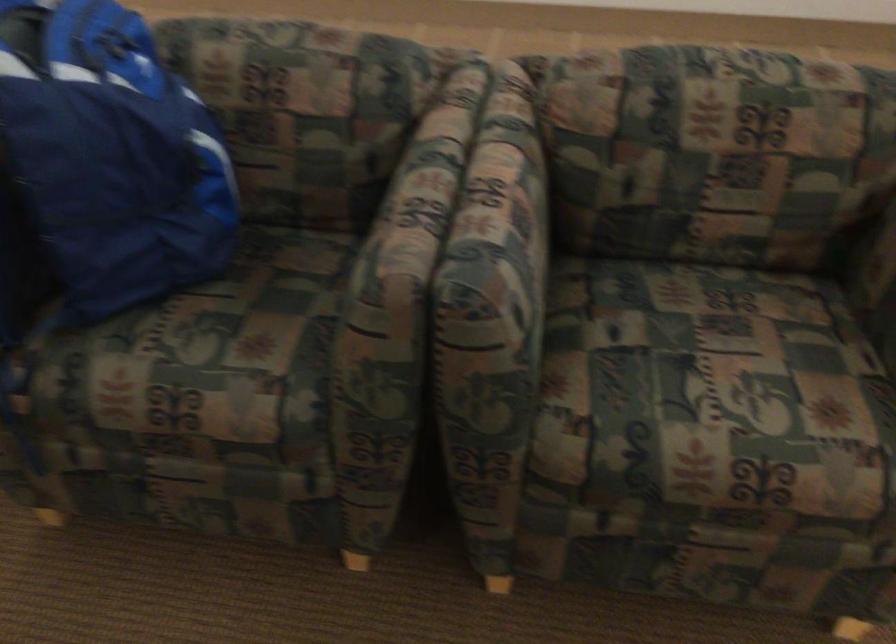
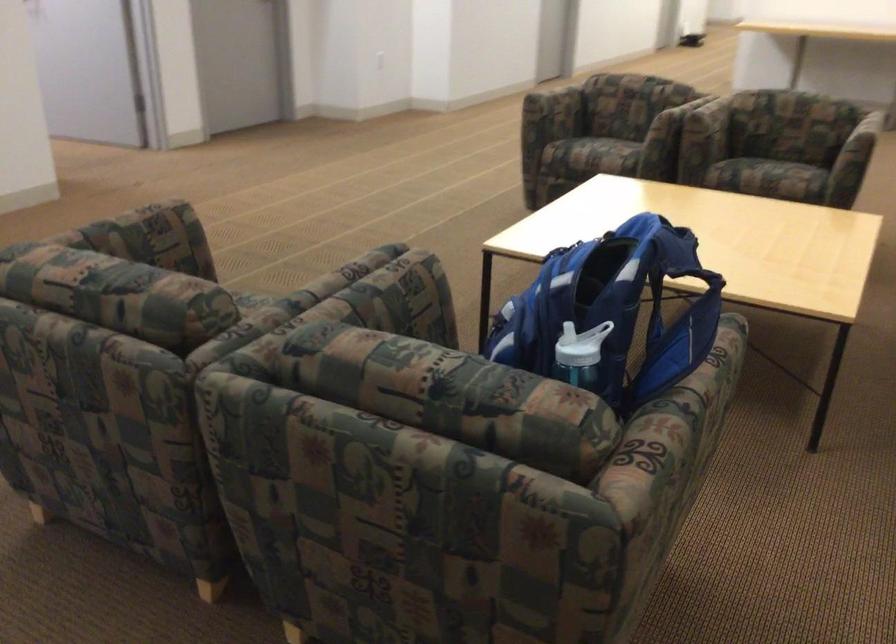
Question: I am providing you with two images of the same scene from different viewpoints. Which of the following objects are not visible in image2?

Choices:
 (A) blue backpack handle
 (B) chair sitting surface
 (C) metal mop handle
 (D) sofa sitting surface

Answer: (D)